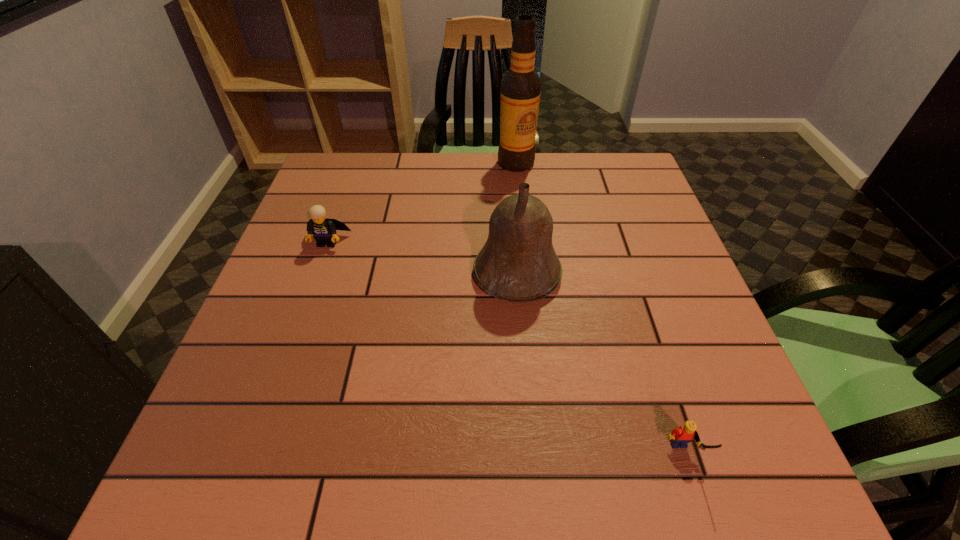
The image size is (960, 540). What are the coordinates of `object present at the far edge` in the screenshot? It's located at (521, 85).

Find the location of a particular element. The image size is (960, 540). object that is at the near edge is located at coordinates (680, 437).

The image size is (960, 540). In order to click on object located at the left edge in this screenshot , I will do `click(323, 230)`.

Image resolution: width=960 pixels, height=540 pixels. In order to click on object located in the right edge section of the desktop in this screenshot , I will do `click(680, 437)`.

Locate an element on the screen. The width and height of the screenshot is (960, 540). object positioned at the near right corner is located at coordinates (680, 437).

What are the coordinates of `free space at the far edge of the desktop` in the screenshot? It's located at (454, 186).

Identify the location of free location at the left edge of the desktop. (293, 298).

At what (x,y) coordinates should I click in order to perform the action: click on vacant space at the right edge of the desktop. Please return your answer as a coordinate pair (x, y). Image resolution: width=960 pixels, height=540 pixels. Looking at the image, I should click on (646, 285).

Where is `vacant space at the far right corner of the desktop`? vacant space at the far right corner of the desktop is located at coordinates tap(634, 194).

Identify the location of vacant space at the near right corner of the desktop. (691, 486).